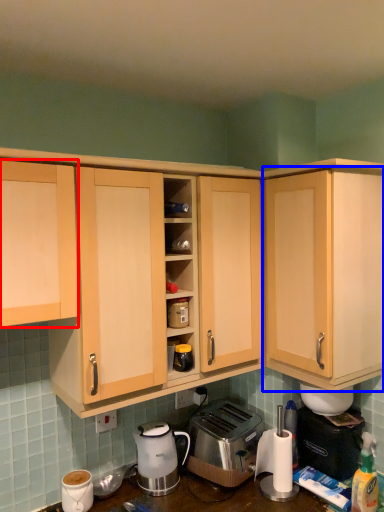
Question: Which point is further to the camera, cabinetry (highlighted by a red box) or cabinetry (highlighted by a blue box)?

Choices:
 (A) cabinetry
 (B) cabinetry

Answer: (B)